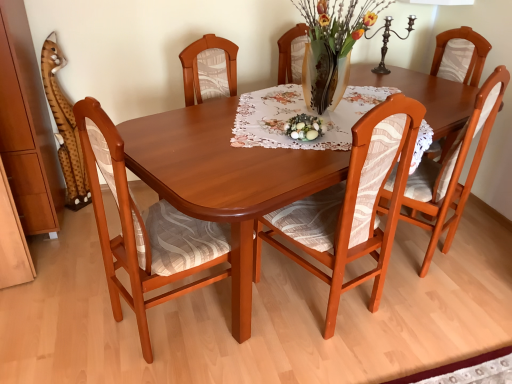
Find the location of a particular element. Image resolution: width=512 pixels, height=384 pixels. vacant space underneath matte wood chair at center, arranged as the first chair when viewed from the right (from a real-world perspective) is located at coordinates tap(411, 251).